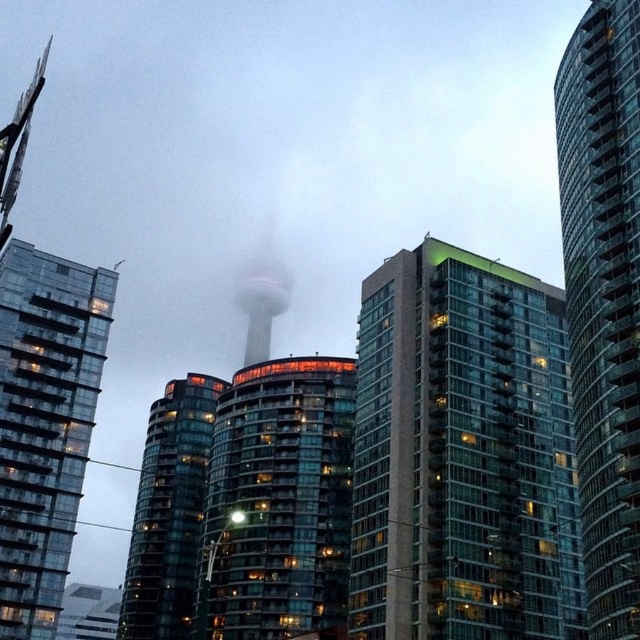
In the scene shown: You are a city planner evaluating the skyline. You notice two key buildings in the scene. The first is the transparent glass tower at center, and the second is the glassy reflective building at center. Which of these two buildings has a greater height?

The glassy reflective building at center is taller than the transparent glass tower at center, so the glassy reflective building at center has a greater height.

You are standing at the center of the city and looking towards the transparent glass tower at center. Based on its position, can you determine if the tower is closer to the foreground or background of the image?

The transparent glass tower at center is located at point (604, 298), which places it closer to the background of the image since the y coordinate is near 1.0, indicating a position towards the bottom of the image where the background elements are typically placed.

You are standing in the city at twilight and see two points of light in the distance. The first is at coordinates point (372,401), and the second is at point (284,508). Which point is closer to you based on their positions?

Point (372,401) is in front of point (284,508), so the first point is closer to you.